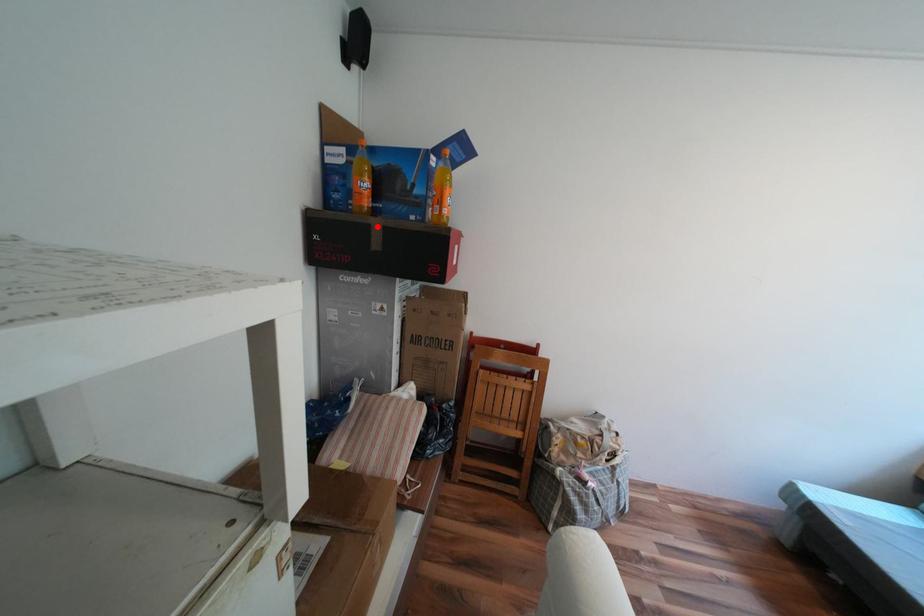
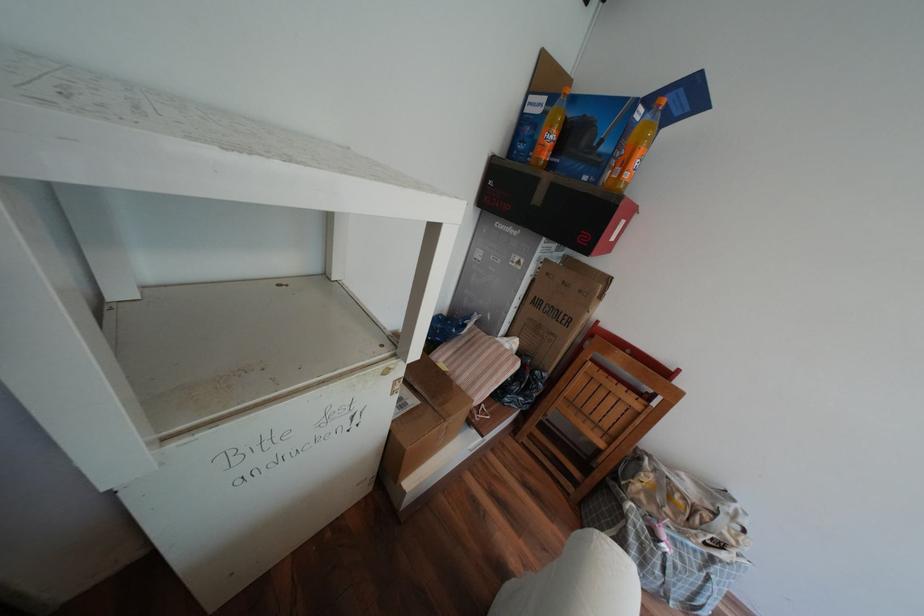
The point at the highlighted location is marked in the first image. Where is the corresponding point in the second image?

(545, 180)